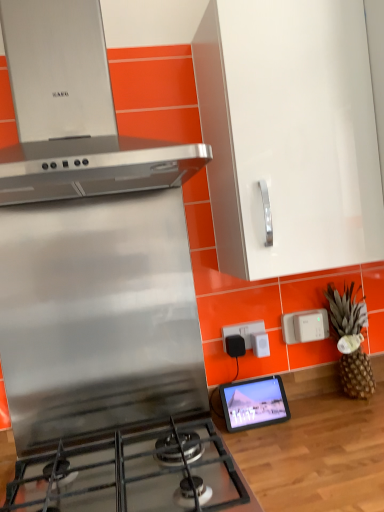
Question: Is stainless steel stove at center completely or partially outside of white plastic power strip at center?

Choices:
 (A) no
 (B) yes

Answer: (B)

Question: Does stainless steel stove at center have a greater height compared to white plastic power strip at center?

Choices:
 (A) yes
 (B) no

Answer: (A)

Question: From a real-world perspective, is stainless steel stove at center on white plastic power strip at center?

Choices:
 (A) yes
 (B) no

Answer: (A)

Question: Considering the relative sizes of stainless steel stove at center and white plastic power strip at center in the image provided, is stainless steel stove at center shorter than white plastic power strip at center?

Choices:
 (A) no
 (B) yes

Answer: (A)

Question: Is stainless steel stove at center facing away from white plastic power strip at center?

Choices:
 (A) no
 (B) yes

Answer: (A)

Question: Is stainless steel stove at center bigger than white plastic power strip at center?

Choices:
 (A) yes
 (B) no

Answer: (A)

Question: Is matte black tablet at center not inside stainless steel gas stove at lower left?

Choices:
 (A) yes
 (B) no

Answer: (A)

Question: Considering the relative positions of matte black tablet at center and stainless steel gas stove at lower left in the image provided, is matte black tablet at center in front of stainless steel gas stove at lower left?

Choices:
 (A) yes
 (B) no

Answer: (B)

Question: Can you confirm if matte black tablet at center is thinner than stainless steel gas stove at lower left?

Choices:
 (A) yes
 (B) no

Answer: (A)

Question: Is matte black tablet at center taller than stainless steel gas stove at lower left?

Choices:
 (A) yes
 (B) no

Answer: (A)

Question: Does matte black tablet at center come behind stainless steel gas stove at lower left?

Choices:
 (A) no
 (B) yes

Answer: (B)

Question: Is matte black tablet at center with stainless steel gas stove at lower left?

Choices:
 (A) no
 (B) yes

Answer: (A)

Question: From a real-world perspective, is black plastic outlet at center, the first electric outlet in the left-to-right sequence, positioned under white plastic power strip at center based on gravity?

Choices:
 (A) no
 (B) yes

Answer: (A)